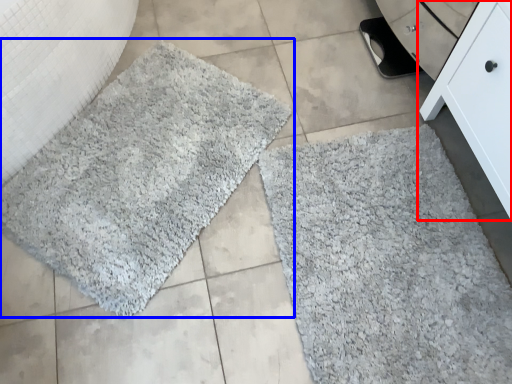
Question: Which of the following is the closest to the observer, furniture (highlighted by a red box) or bath mat (highlighted by a blue box)?

Choices:
 (A) furniture
 (B) bath mat

Answer: (A)